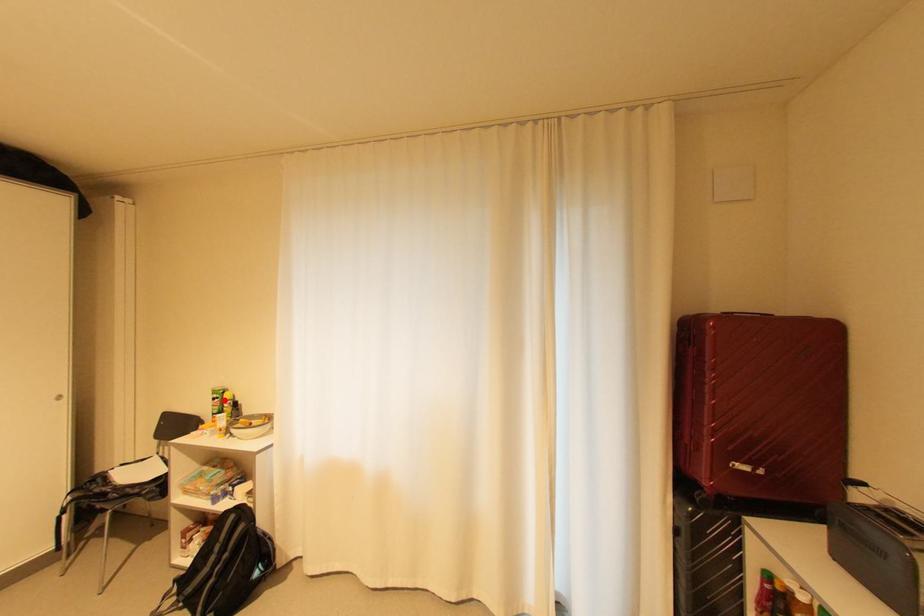
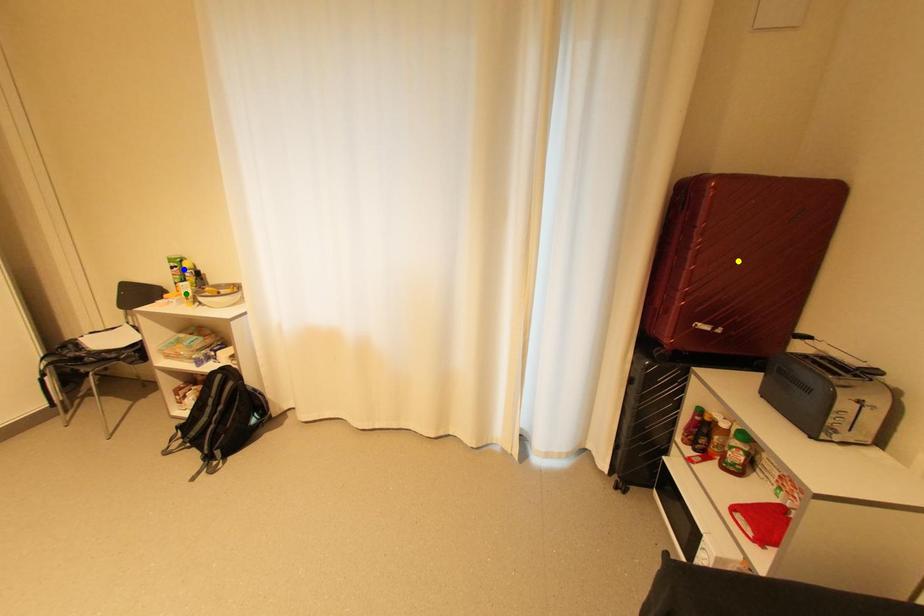
Question: I am providing you with two images of the same scene from different viewpoints. A red point is marked on the first image. You are given multiple points on the second image. Which point in image 2 is actually the same real-world point as the red point in image 1?

Choices:
 (A) blue point
 (B) yellow point
 (C) green point

Answer: (A)